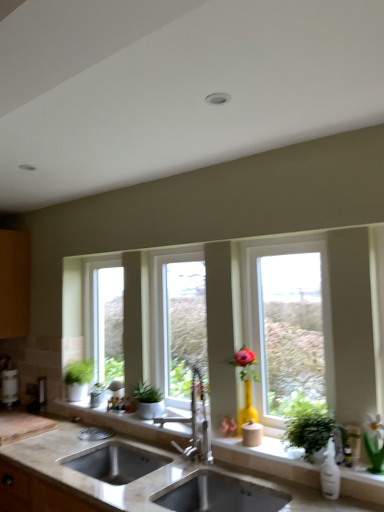
Find the location of a particular element. free spot above clear glass window at center, placed as the 2th window when sorted from back to front (from a real-world perspective) is located at coordinates (178, 248).